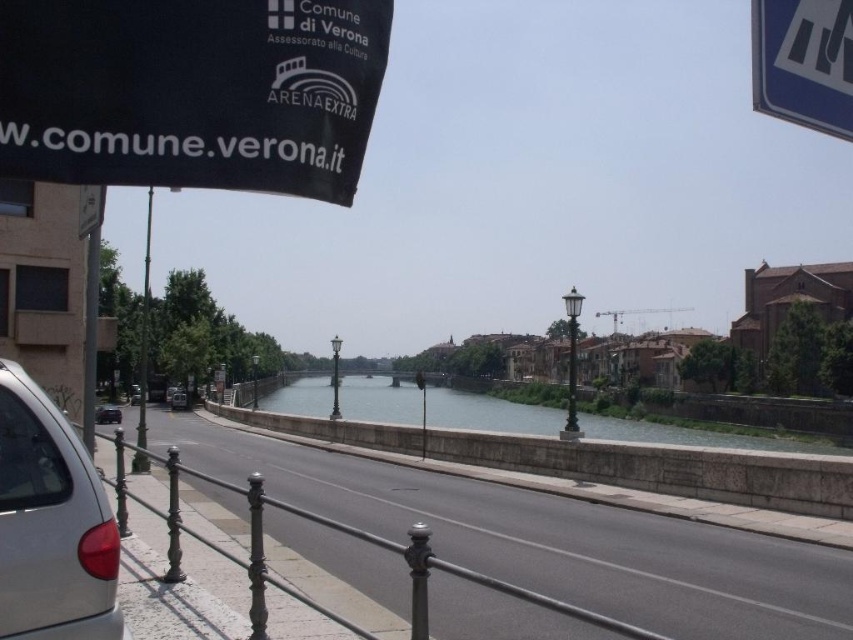
You are a tourist in Verona and see the clear water at center and the blue plastic sign at upper right. Which object is located to the right side of the other?

The clear water at center is to the left of blue plastic sign at upper right, so the blue plastic sign at upper right is located to the right of the clear water at center.

You are a photographer standing on the bridge and want to capture both the clear water at center and the black metal pole at center in your shot. Which object will occupy more space in your photo?

The clear water at center has a larger size compared to the black metal pole at center, so it will occupy more space in the photo.